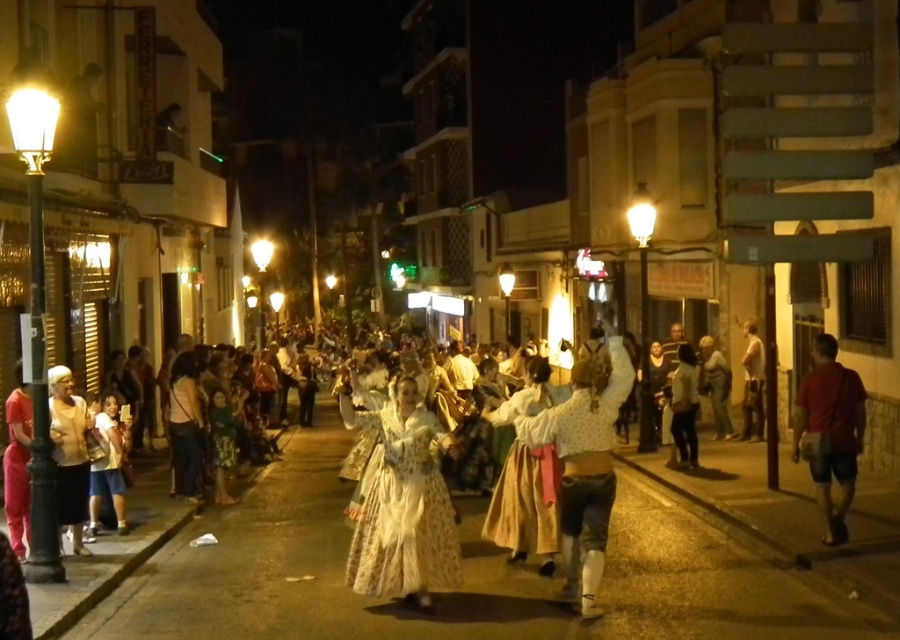
You are a photographer at the event and want to capture both the white lace blouse at center and the light beige fabric dress at lower left in a single frame. Which clothing item will appear smaller in the photo?

The white lace blouse at center will appear smaller in the photo because it has a smaller size compared to the light beige fabric dress at lower left.

You are a photographer at this event and want to capture a photo of the white lace dress at center and the red cotton shirt at right. From the photographer perspective, which one is lower in the frame?

The white lace dress at center is below the red cotton shirt at right, so in the frame, the white lace dress at center appears lower than the red cotton shirt at right.

You are a photographer trying to capture the dancers in the center of the street. You notice the white lace blouse at center and the light beige fabric dress at lower left. Which of these two items is shorter in height?

The white lace blouse at center is shorter in height compared to the light beige fabric dress at lower left.